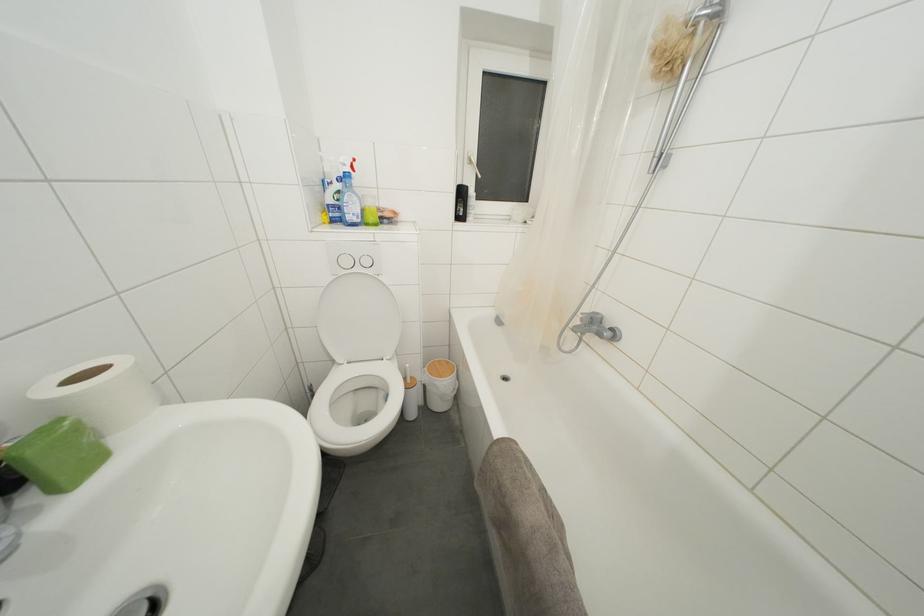
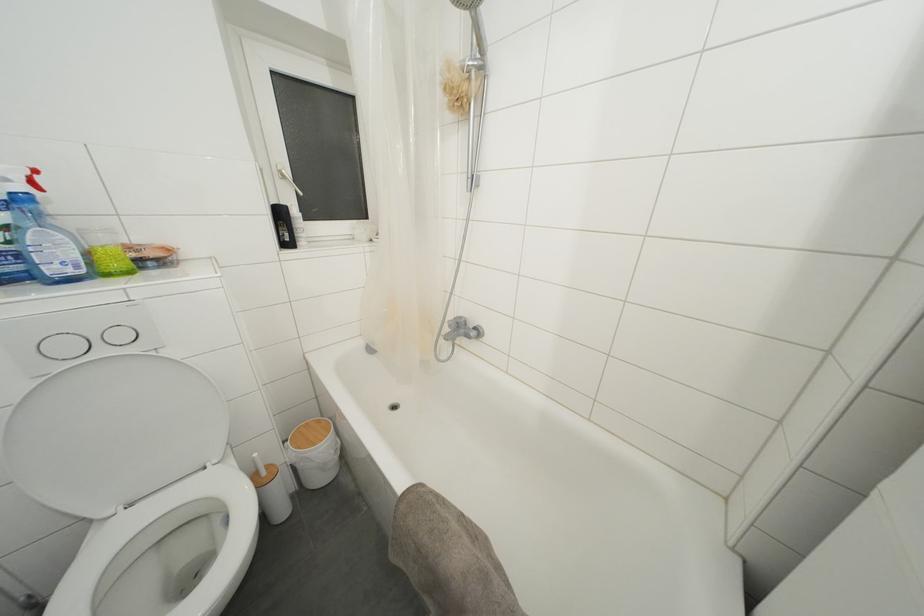
Locate, in the second image, the point that corresponds to (x=373, y=208) in the first image.

(108, 245)